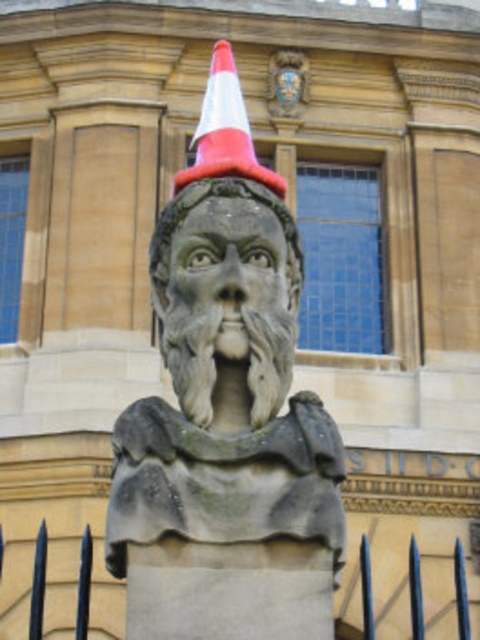
Question: Which object is the farthest from the gray stone face at center?

Choices:
 (A) white and orange cone at center
 (B) black metal spikes at lower center
 (C) stone statue at center

Answer: (B)

Question: Considering the real-world distances, which object is farthest from the gray stone face at center?

Choices:
 (A) black metal spikes at lower center
 (B) stone statue at center

Answer: (A)

Question: Does gray stone face at center appear on the left side of black metal spikes at lower center?

Choices:
 (A) no
 (B) yes

Answer: (B)

Question: Does stone statue at center have a larger size compared to white and orange cone at center?

Choices:
 (A) no
 (B) yes

Answer: (A)

Question: Which object is positioned farthest from the white and orange cone at center?

Choices:
 (A) black metal spikes at lower center
 (B) stone statue at center

Answer: (A)

Question: Is the position of stone statue at center more distant than that of white and orange cone at center?

Choices:
 (A) yes
 (B) no

Answer: (B)